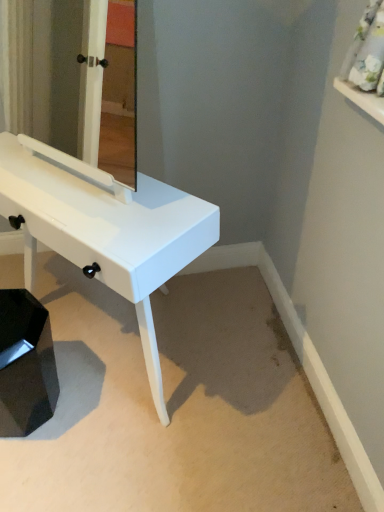
Question: Looking at their shapes, would you say white glossy table at center is wider or thinner than white glossy mirror at center?

Choices:
 (A) wide
 (B) thin

Answer: (A)

Question: Looking at the image, does white glossy table at center seem bigger or smaller compared to white glossy mirror at center?

Choices:
 (A) small
 (B) big

Answer: (B)

Question: Estimate the real-world distances between objects in this image. Which object is closer to the black glossy step stool at lower left?

Choices:
 (A) white glossy table at center
 (B) white glossy mirror at center

Answer: (A)

Question: Which of these objects is positioned closest to the white glossy table at center?

Choices:
 (A) black glossy step stool at lower left
 (B) white glossy mirror at center

Answer: (A)